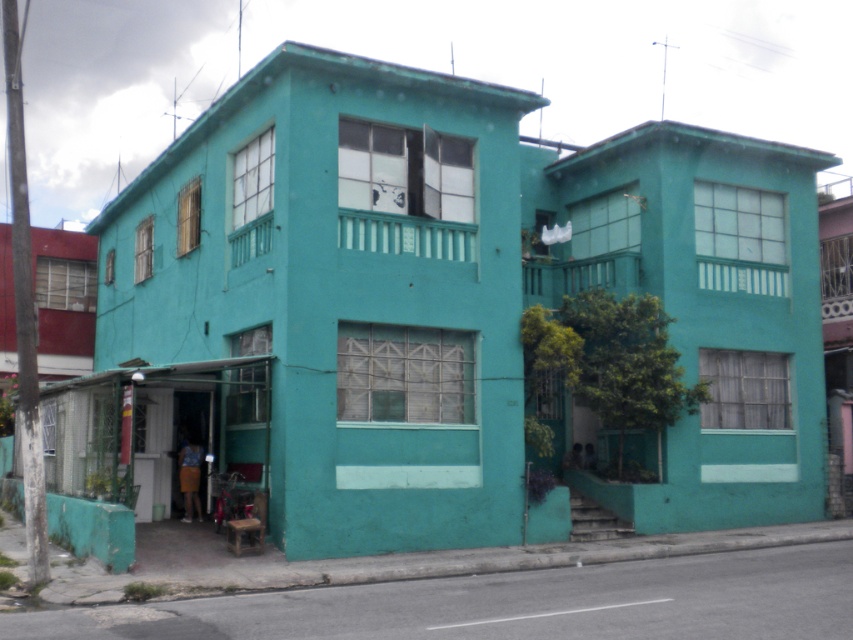
Question: Is teal matte building at center thinner than matte teal building at upper right?

Choices:
 (A) yes
 (B) no

Answer: (B)

Question: Is teal matte building at center positioned behind matte teal building at upper right?

Choices:
 (A) yes
 (B) no

Answer: (B)

Question: Can you confirm if teal matte building at center is positioned to the left of matte teal building at upper right?

Choices:
 (A) no
 (B) yes

Answer: (B)

Question: Which of the following is the farthest from the observer?

Choices:
 (A) (752, 513)
 (B) (421, 257)

Answer: (A)

Question: Which point is farther to the camera?

Choices:
 (A) (265, 397)
 (B) (817, 352)

Answer: (B)